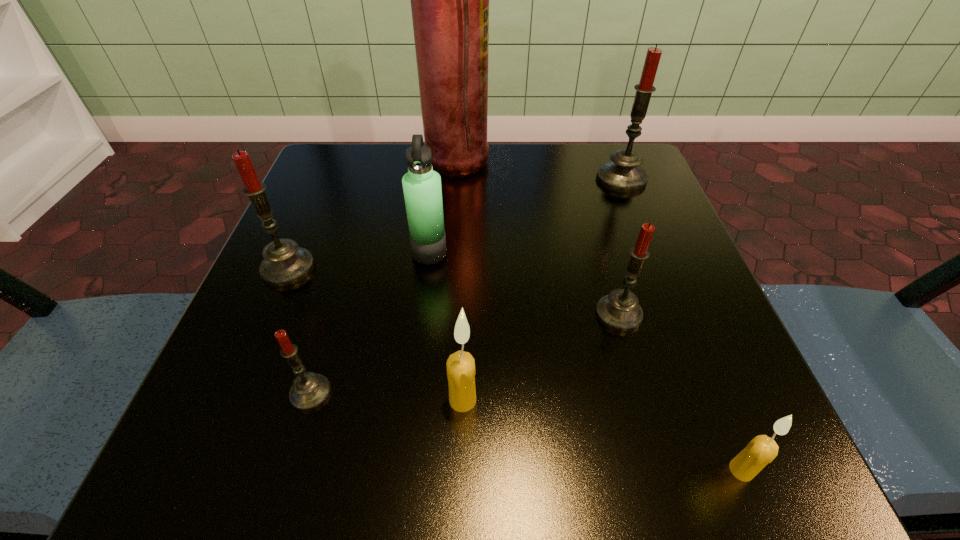
You are a GUI agent. You are given a task and a screenshot of the screen. Output one action in this format:
    pyautogui.click(x=<x>, y=<y>)
    Task: Click on the vacant point located 0.200m on the left of the farther cream candle
    
    Given the screenshot: What is the action you would take?
    pyautogui.click(x=298, y=400)

I want to click on vacant space located on the back of the smallest red candle, so click(344, 281).

Identify the location of free space located on the back of the nearer cream candle. This screenshot has width=960, height=540. (648, 239).

Locate an element on the screen. fire extinguisher located at the far edge is located at coordinates (449, 0).

The width and height of the screenshot is (960, 540). Identify the location of candle situated at the far edge. (623, 173).

Find the location of `object at the far right corner`. object at the far right corner is located at coordinates (623, 173).

Find the location of a particular element. object present at the near right corner is located at coordinates (760, 451).

You are a GUI agent. You are given a task and a screenshot of the screen. Output one action in this format:
    pyautogui.click(x=<x>, y=<y>)
    Task: Click on the free space at the far edge of the desktop
    
    Given the screenshot: What is the action you would take?
    pyautogui.click(x=567, y=186)

The width and height of the screenshot is (960, 540). In the image, there is a desktop. What are the coordinates of `vacant space at the near edge` in the screenshot? It's located at (474, 442).

Find the location of a particular element. vacant space at the left edge of the desktop is located at coordinates click(x=269, y=403).